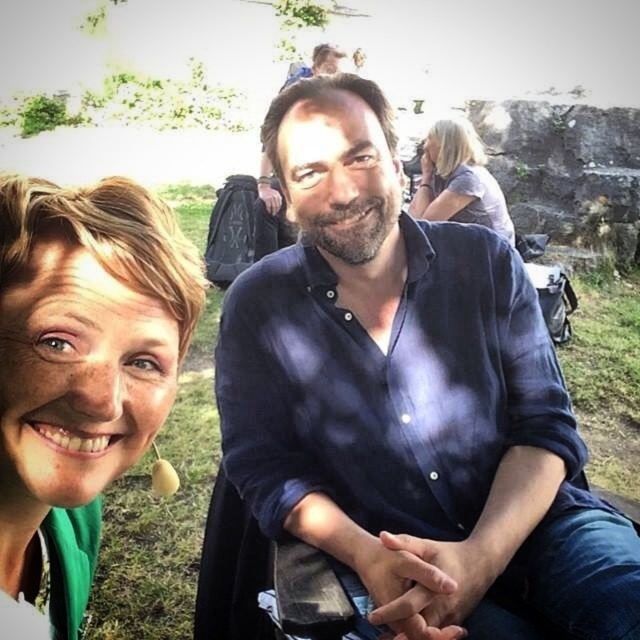
Question: Is blue cotton shirt at center bigger than green fabric at left?

Choices:
 (A) yes
 (B) no

Answer: (A)

Question: Does blue cotton shirt at center have a smaller size compared to green fabric at left?

Choices:
 (A) no
 (B) yes

Answer: (A)

Question: Estimate the real-world distances between objects in this image. Which object is farther from the green fabric at left?

Choices:
 (A) blue cotton shirt at center
 (B) blonde hair at upper right

Answer: (B)

Question: Does blue cotton shirt at center come in front of blonde hair at upper right?

Choices:
 (A) yes
 (B) no

Answer: (A)

Question: Which object appears farthest from the camera in this image?

Choices:
 (A) green fabric at left
 (B) blonde hair at upper right
 (C) blue cotton shirt at center

Answer: (B)

Question: Which point is farther from the camera taking this photo?

Choices:
 (A) (88, 444)
 (B) (452, 141)

Answer: (B)